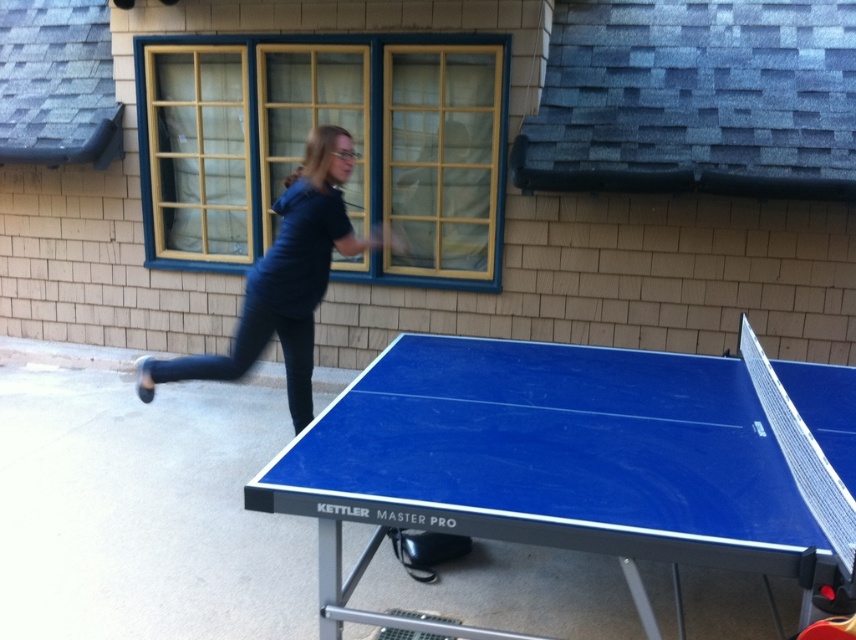
Question: Can you confirm if blue glossy table tennis table at center is positioned to the left of dark blue fabric at upper center?

Choices:
 (A) yes
 (B) no

Answer: (B)

Question: Does blue glossy table tennis table at center have a greater width compared to dark blue fabric at upper center?

Choices:
 (A) yes
 (B) no

Answer: (A)

Question: Which object appears farthest from the camera in this image?

Choices:
 (A) dark blue fabric at upper center
 (B) blue glossy table tennis table at center

Answer: (A)

Question: Which point appears closest to the camera in this image?

Choices:
 (A) (562, 531)
 (B) (376, 240)

Answer: (A)

Question: Is blue glossy table tennis table at center bigger than dark blue fabric at upper center?

Choices:
 (A) no
 (B) yes

Answer: (B)